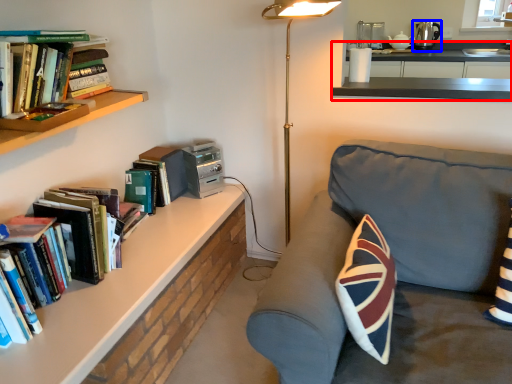
Question: Which point is closer to the camera, counter (highlighted by a red box) or appliance (highlighted by a blue box)?

Choices:
 (A) counter
 (B) appliance

Answer: (A)